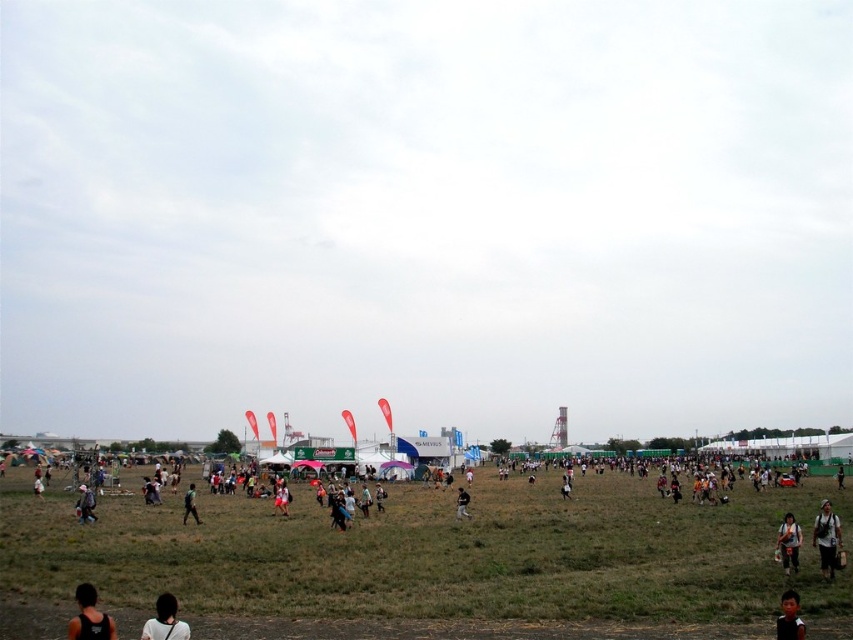
You are standing at the point labeled as point (785, 636) in the image. A friend is at the viewer position. How far apart are you and your friend?

The distance between point (785, 636) and the viewer is 78.12 meters, so you and your friend are 78.12 meters apart.

Based on the photo, you are a photographer at the festival and want to capture both the white matte shirt at lower left and the light brown fabric pants at lower left in a single frame. Which object should you focus on first to ensure both are in the frame?

You should focus on the light brown fabric pants at lower left first since it is larger than the white matte shirt at lower left, ensuring both will fit in the frame.